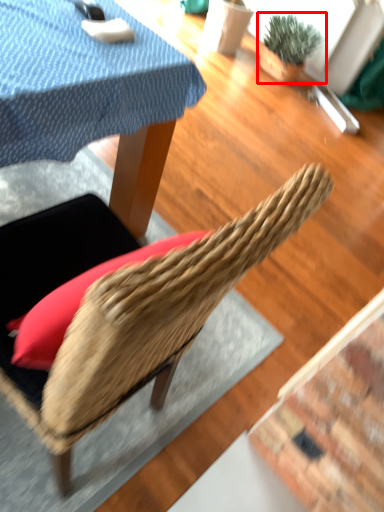
Question: From the image's perspective, what is the correct spatial relationship of houseplant (annotated by the red box) in relation to chair?

Choices:
 (A) below
 (B) above

Answer: (B)